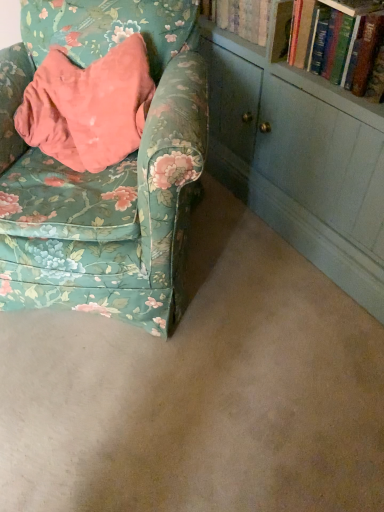
Question: Does point (301, 1) appear closer or farther from the camera than point (188, 15)?

Choices:
 (A) closer
 (B) farther

Answer: (A)

Question: From the image's perspective, relative to floral fabric chair at left, is hardcover book at upper right above or below?

Choices:
 (A) below
 (B) above

Answer: (B)

Question: Looking at the image, does hardcover book at upper right seem bigger or smaller compared to floral fabric chair at left?

Choices:
 (A) small
 (B) big

Answer: (A)

Question: Looking at their shapes, would you say floral fabric chair at left is wider or thinner than hardcover book at upper right?

Choices:
 (A) thin
 (B) wide

Answer: (B)

Question: Considering their positions, is floral fabric chair at left located in front of or behind hardcover book at upper right?

Choices:
 (A) behind
 (B) front

Answer: (B)

Question: Is point [43, 156] closer or farther from the camera than point [337, 0]?

Choices:
 (A) closer
 (B) farther

Answer: (B)

Question: From a real-world perspective, is floral fabric chair at left positioned above or below hardcover book at upper right?

Choices:
 (A) above
 (B) below

Answer: (B)